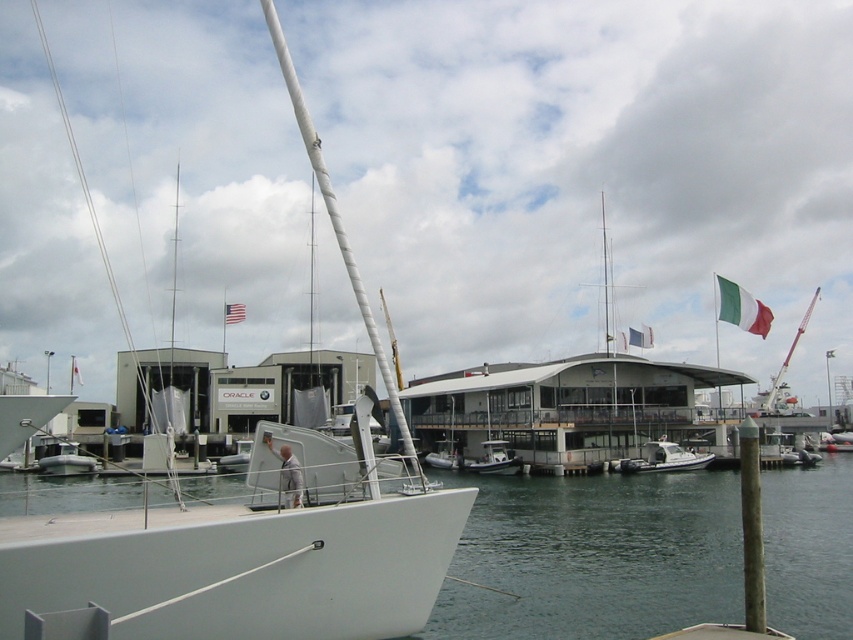
Can you confirm if white matte sailboat at center is wider than green fabric flag at upper right?

Yes, white matte sailboat at center is wider than green fabric flag at upper right.

Between point (235, 627) and point (653, 339), which one is positioned in front?

Positioned in front is point (235, 627).

At what (x,y) coordinates should I click in order to perform the action: click on white matte sailboat at center. Please return your answer as a coordinate pair (x, y). The width and height of the screenshot is (853, 640). Looking at the image, I should click on (235, 566).

Is point (641, 460) in front of point (235, 305)?

Yes, it is.

Is white plastic boat at lower right below white fabric flag at upper center?

Yes, white plastic boat at lower right is below white fabric flag at upper center.

You are a GUI agent. You are given a task and a screenshot of the screen. Output one action in this format:
    pyautogui.click(x=<x>, y=<y>)
    Task: Click on the white plastic boat at lower right
    This screenshot has height=640, width=853.
    Given the screenshot: What is the action you would take?
    pyautogui.click(x=665, y=458)

Which is above, green-white-red fabric flag at upper right or white fabric flag at upper center?

Positioned higher is green-white-red fabric flag at upper right.

Between point (764, 317) and point (233, 320), which one is positioned behind?

The point (233, 320) is behind.

I want to click on green-white-red fabric flag at upper right, so click(741, 308).